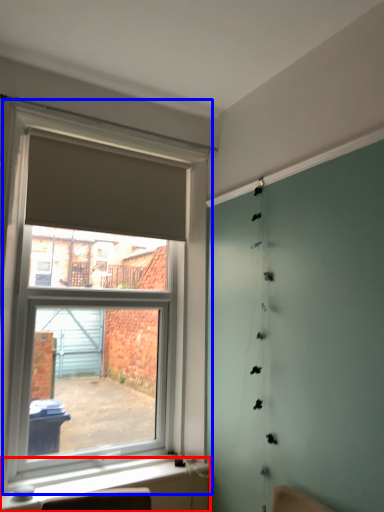
Question: Which point is further to the camera, window sill (highlighted by a red box) or window (highlighted by a blue box)?

Choices:
 (A) window sill
 (B) window

Answer: (A)